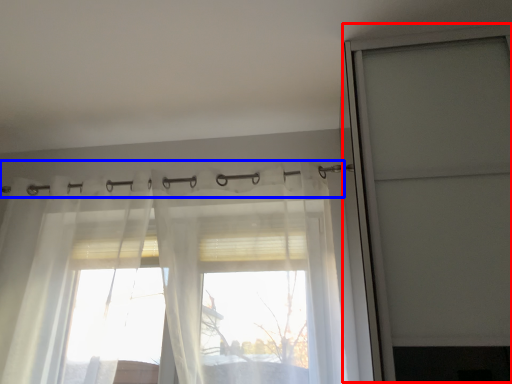
Question: Which of the following is the farthest to the observer, screen door (highlighted by a red box) or clothesline (highlighted by a blue box)?

Choices:
 (A) screen door
 (B) clothesline

Answer: (B)